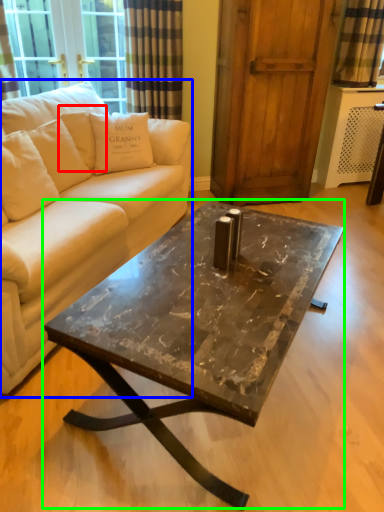
Question: Which object is positioned closest to pillow (highlighted by a red box)? Select from studio couch (highlighted by a blue box) and coffee table (highlighted by a green box).

Choices:
 (A) studio couch
 (B) coffee table

Answer: (A)